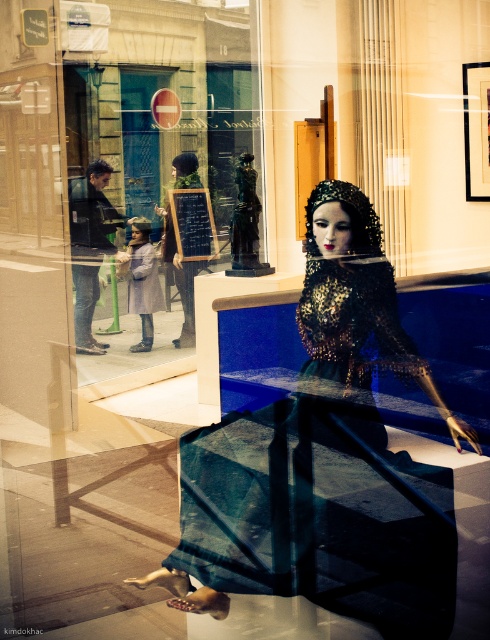
You are a fashion designer who wants to display two dresses in a store window. The shiny sequined dress at center and the matte black dress at center are both available. Which dress takes up less space in the window display?

The shiny sequined dress at center has a smaller size compared to the matte black dress at center, so it takes up less space in the window display.

You are a customer in a boutique store and see the shiny sequined dress at center and the matte black dress at center. Which dress is positioned more to the left side?

The matte black dress at center is positioned more to the left side because the shiny sequined dress at center is to its right.